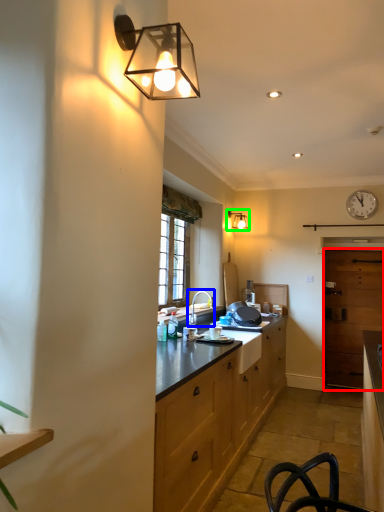
Question: Which object is the closest to the glass door (highlighted by a red box)? Choose among these: tap (highlighted by a blue box) or lamp (highlighted by a green box).

Choices:
 (A) tap
 (B) lamp

Answer: (B)